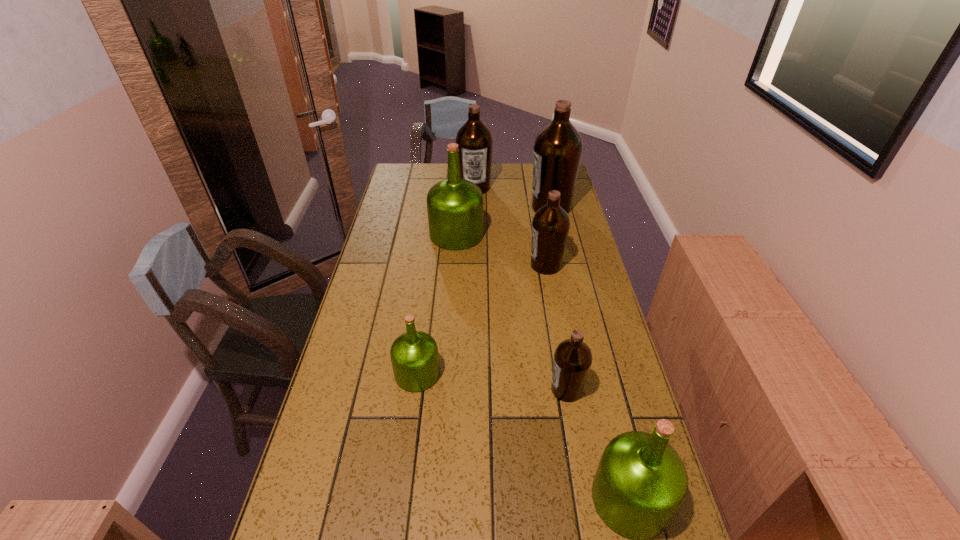
The height and width of the screenshot is (540, 960). Identify the location of the biggest brown olive oil. (558, 147).

Image resolution: width=960 pixels, height=540 pixels. I want to click on the tallest object, so [558, 147].

Locate an element on the screen. Image resolution: width=960 pixels, height=540 pixels. the leftmost brown olive oil is located at coordinates (475, 142).

Find the location of a particular element. the third farthest olive oil is located at coordinates (454, 206).

Locate an element on the screen. The width and height of the screenshot is (960, 540). the biggest green olive oil is located at coordinates pos(454,206).

Identify the location of the third farthest brown olive oil. (550, 226).

The image size is (960, 540). I want to click on the fourth farthest object, so pos(550,226).

This screenshot has width=960, height=540. I want to click on the smallest green olive oil, so click(414, 355).

The height and width of the screenshot is (540, 960). I want to click on the nearest brown olive oil, so click(x=572, y=359).

Where is `vacant space located 0.350m on the label of the biggest brown olive oil`? The height and width of the screenshot is (540, 960). vacant space located 0.350m on the label of the biggest brown olive oil is located at coordinates (447, 207).